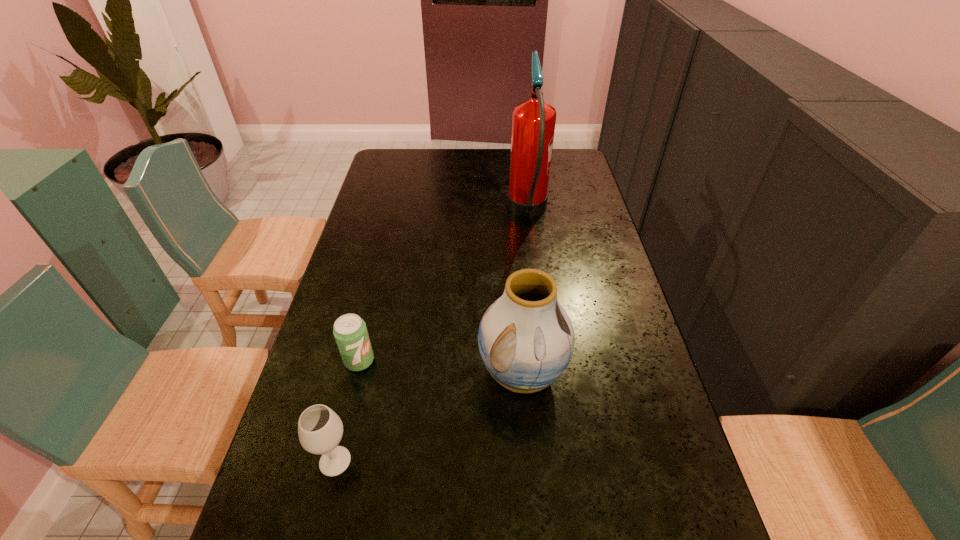
Identify the location of wineglass located at the left edge. (320, 429).

Locate an element on the screen. This screenshot has height=540, width=960. soda located in the left edge section of the desktop is located at coordinates (350, 332).

This screenshot has width=960, height=540. I want to click on vacant region at the far edge of the desktop, so click(497, 155).

Identify the location of free space at the left edge of the desktop. Image resolution: width=960 pixels, height=540 pixels. (386, 201).

Image resolution: width=960 pixels, height=540 pixels. I want to click on free location at the right edge of the desktop, so click(603, 220).

The height and width of the screenshot is (540, 960). In the image, there is a desktop. What are the coordinates of `free space at the far left corner` in the screenshot? It's located at (408, 159).

Where is `vacant space at the far right corner of the desktop`? The image size is (960, 540). vacant space at the far right corner of the desktop is located at coordinates (582, 170).

Identify the location of free space between the wineglass and the vase. (428, 417).

Identify the location of vacant space in between the shortest object and the wineglass. The height and width of the screenshot is (540, 960). (348, 411).

The width and height of the screenshot is (960, 540). I want to click on vacant area that lies between the tallest object and the shortest object, so click(x=444, y=286).